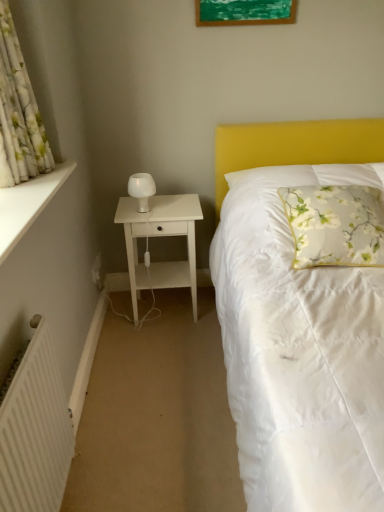
What is the approximate width of white painted wood at left?

The width of white painted wood at left is 32.11 centimeters.

Measure the distance between white frosted glass lamp at left and camera.

A distance of 7.16 feet exists between white frosted glass lamp at left and camera.

This screenshot has width=384, height=512. I want to click on white matte radiator at lower left, so click(35, 432).

The width and height of the screenshot is (384, 512). I want to click on white painted wood at left, so click(27, 205).

In the scene shown: From the image's perspective, which is below, white matte nightstand at left or white painted wood at left?

white matte nightstand at left, from the image's perspective.

Considering the sizes of objects white matte nightstand at left and white painted wood at left in the image provided, who is thinner, white matte nightstand at left or white painted wood at left?

white painted wood at left is thinner.

Is white matte nightstand at left situated inside white painted wood at left or outside?

white matte nightstand at left is outside white painted wood at left.

Is point (166, 236) closer to viewer compared to point (331, 217)?

No, it is not.

From the image's perspective, which one is positioned lower, white matte nightstand at left or floral fabric pillow at center?

From the image's view, white matte nightstand at left is below.

Is the depth of white matte nightstand at left less than that of floral fabric pillow at center?

No, white matte nightstand at left is further to the viewer.

Which is in front, point (134, 184) or point (43, 161)?

Point (43, 161)

Based on the photo, from a real-world perspective, which is physically below, white frosted glass lamp at left or white floral fabric curtain at left?

white frosted glass lamp at left, from a real-world perspective.

How different are the orientations of white frosted glass lamp at left and white floral fabric curtain at left in degrees?

The angle between the facing direction of white frosted glass lamp at left and the facing direction of white floral fabric curtain at left is 88.3 degrees.

Considering the sizes of white frosted glass lamp at left and white floral fabric curtain at left in the image, is white frosted glass lamp at left taller or shorter than white floral fabric curtain at left?

Clearly, white frosted glass lamp at left is shorter compared to white floral fabric curtain at left.

Which is behind, white matte radiator at lower left or white frosted glass lamp at left?

white frosted glass lamp at left.

Consider the image. Which of these two, white matte radiator at lower left or white frosted glass lamp at left, stands taller?

white matte radiator at lower left is taller.

Is white matte radiator at lower left placed right next to white frosted glass lamp at left?

No, white matte radiator at lower left is not touching white frosted glass lamp at left.

In terms of height, does white painted wood at left look taller or shorter compared to floral fabric pillow at center?

white painted wood at left is shorter than floral fabric pillow at center.

From the image's perspective, is white painted wood at left beneath floral fabric pillow at center?

No.

From the image's perspective, is white floral fabric curtain at left located above white painted wood at left?

Indeed, from the image's perspective, white floral fabric curtain at left is shown above white painted wood at left.

I want to click on window sill located in front of the white floral fabric curtain at left, so click(27, 205).

How distant is white floral fabric curtain at left from white painted wood at left?

8.89 inches.

Is white floral fabric curtain at left not close to white painted wood at left?

Actually, white floral fabric curtain at left and white painted wood at left are a little close together.

Which object is closer to the camera taking this photo, floral fabric pillow at center or white frosted glass lamp at left?

floral fabric pillow at center is in front.

Is floral fabric pillow at center placed right next to white frosted glass lamp at left?

No, floral fabric pillow at center is not making contact with white frosted glass lamp at left.

From a real-world perspective, which is physically below, floral fabric pillow at center or white frosted glass lamp at left?

floral fabric pillow at center, from a real-world perspective.

Is floral fabric pillow at center turned away from white frosted glass lamp at left?

floral fabric pillow at center is not turned away from white frosted glass lamp at left.

You are a GUI agent. You are given a task and a screenshot of the screen. Output one action in this format:
    pyautogui.click(x=<x>, y=<y>)
    Task: Click on the nightstand located underneath the white painted wood at left (from a real-world perspective)
    Image resolution: width=384 pixels, height=512 pixels.
    Given the screenshot: What is the action you would take?
    pyautogui.click(x=160, y=236)

I want to click on pillow located in front of the white matte nightstand at left, so click(335, 225).

Estimate the real-world distances between objects in this image. Which object is closer to white frosted glass lamp at left, white floral fabric curtain at left or white matte radiator at lower left?

white floral fabric curtain at left is positioned closer to the anchor white frosted glass lamp at left.

Which object lies nearer to the anchor point white frosted glass lamp at left, floral fabric pillow at center or white matte radiator at lower left?

The object closer to white frosted glass lamp at left is floral fabric pillow at center.

Which object lies nearer to the anchor point green matte picture frame at upper center, white floral fabric curtain at left or floral fabric pillow at center?

Among the two, floral fabric pillow at center is located nearer to green matte picture frame at upper center.

Considering their positions, is white painted wood at left positioned closer to floral fabric pillow at center than green matte picture frame at upper center?

green matte picture frame at upper center lies closer to floral fabric pillow at center than the other object.

Based on their spatial positions, is white frosted glass lamp at left or green matte picture frame at upper center further from white painted wood at left?

green matte picture frame at upper center.

Estimate the real-world distances between objects in this image. Which object is closer to white frosted glass lamp at left, white matte radiator at lower left or white matte nightstand at left?

The object closer to white frosted glass lamp at left is white matte nightstand at left.

Considering their positions, is white matte nightstand at left positioned further to white frosted glass lamp at left than white painted wood at left?

white painted wood at left is positioned further to the anchor white frosted glass lamp at left.

From the image, which object appears to be farther from green matte picture frame at upper center, white matte radiator at lower left or white painted wood at left?

white matte radiator at lower left lies further to green matte picture frame at upper center than the other object.

You are a GUI agent. You are given a task and a screenshot of the screen. Output one action in this format:
    pyautogui.click(x=<x>, y=<y>)
    Task: Click on the curtain between white painted wood at left and white frosted glass lamp at left in the front-back direction
    
    Given the screenshot: What is the action you would take?
    pyautogui.click(x=19, y=112)

You are a GUI agent. You are given a task and a screenshot of the screen. Output one action in this format:
    pyautogui.click(x=<x>, y=<y>)
    Task: Click on the bedside lamp between white floral fabric curtain at left and floral fabric pillow at center from left to right
    The image size is (384, 512).
    Given the screenshot: What is the action you would take?
    pyautogui.click(x=142, y=190)

Where is `window sill situated between white floral fabric curtain at left and floral fabric pillow at center from left to right`? The height and width of the screenshot is (512, 384). window sill situated between white floral fabric curtain at left and floral fabric pillow at center from left to right is located at coordinates (27, 205).

This screenshot has width=384, height=512. I want to click on radiator situated between white painted wood at left and floral fabric pillow at center from left to right, so click(x=35, y=432).